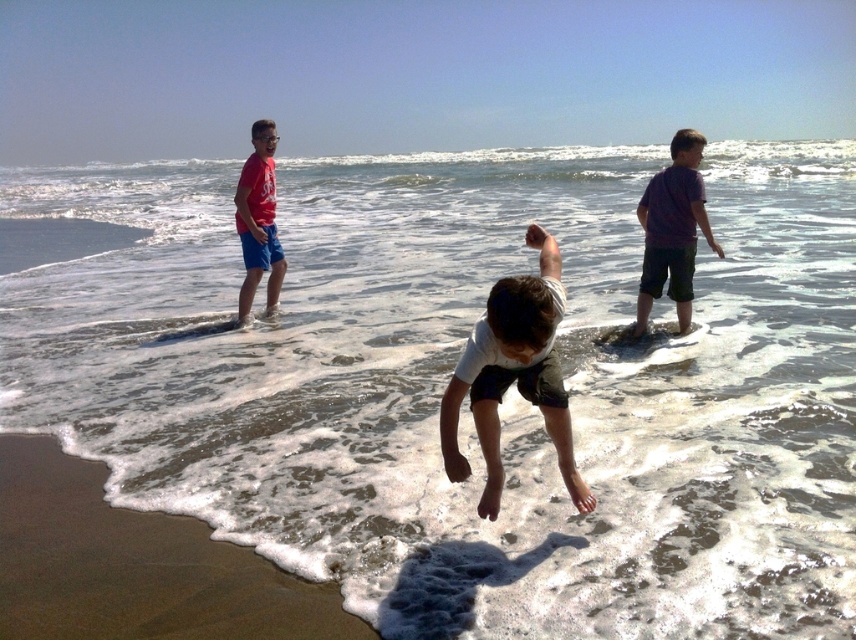
Question: Is purple cotton shirt at right thinner than matte red t-shirt at left?

Choices:
 (A) no
 (B) yes

Answer: (A)

Question: Where is white cotton shirt at center located in relation to matte red t-shirt at left in the image?

Choices:
 (A) above
 (B) below

Answer: (B)

Question: Does brown sandy beach at lower left have a larger size compared to purple cotton shirt at right?

Choices:
 (A) yes
 (B) no

Answer: (A)

Question: Which of the following is the farthest from the observer?

Choices:
 (A) white cotton shirt at center
 (B) brown sandy beach at lower left

Answer: (B)

Question: Which point is closer to the camera taking this photo?

Choices:
 (A) (676, 218)
 (B) (40, 550)
 (C) (544, 256)
 (D) (239, 314)

Answer: (C)

Question: Which of the following is the farthest from the observer?

Choices:
 (A) (638, 312)
 (B) (205, 621)
 (C) (239, 221)
 (D) (525, 323)

Answer: (C)